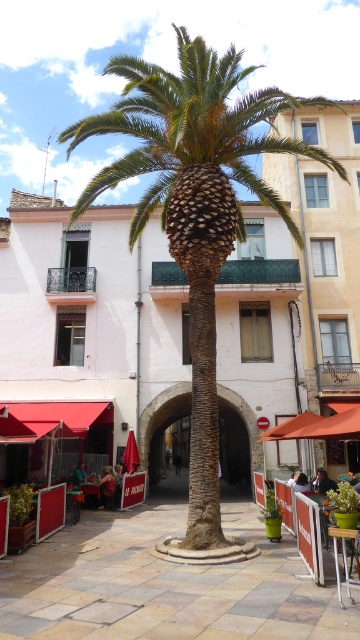
Question: Is smooth white building at center smaller than brown textured palm tree at center?

Choices:
 (A) yes
 (B) no

Answer: (A)

Question: Among these points, which one is nearest to the camera?

Choices:
 (A) click(173, 184)
 (B) click(285, 298)
 (C) click(348, 586)

Answer: (C)

Question: Does brown textured palm tree at center have a greater width compared to wooden table at center?

Choices:
 (A) no
 (B) yes

Answer: (B)

Question: Which point appears farthest from the camera in this image?

Choices:
 (A) click(2, 380)
 (B) click(213, 96)

Answer: (A)

Question: Can you confirm if brown textured palm tree at center is positioned above wooden table at center?

Choices:
 (A) no
 (B) yes

Answer: (B)

Question: Which object is the closest to the wooden table at center?

Choices:
 (A) brown textured palm tree at center
 (B) smooth white building at center

Answer: (A)